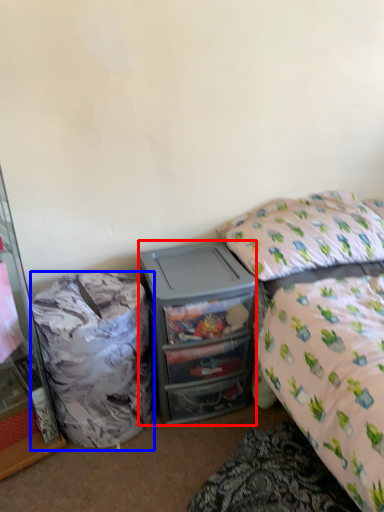
Question: Which object appears closest to the camera in this image, desk (highlighted by a red box) or trash bin/can (highlighted by a blue box)?

Choices:
 (A) desk
 (B) trash bin/can

Answer: (B)